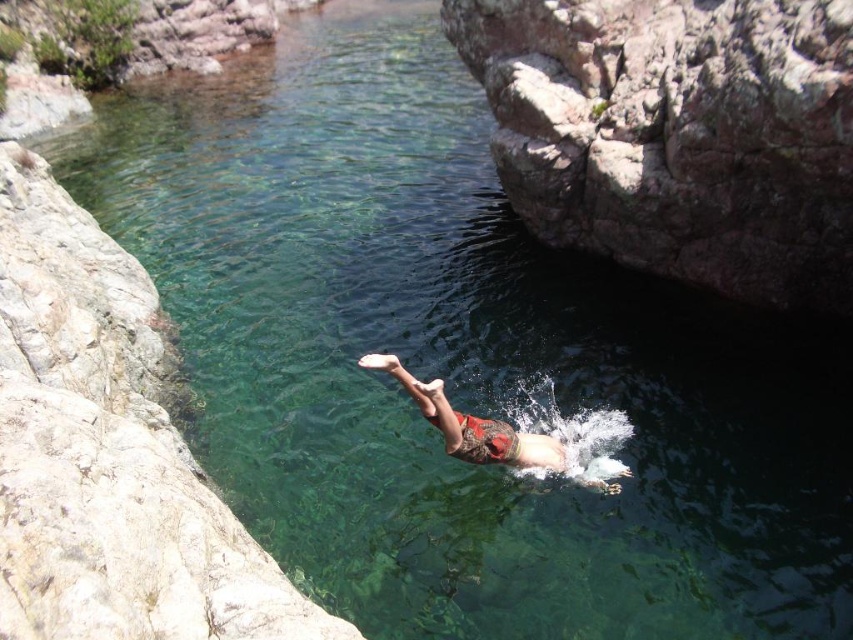
Question: Which object is closer to the camera taking this photo?

Choices:
 (A) smooth gray rock at left
 (B) reddish-brown fabric diver at center
 (C) rusty rock at upper right

Answer: (A)

Question: Which point is closer to the camera taking this photo?

Choices:
 (A) (244, 608)
 (B) (717, 138)

Answer: (A)

Question: Where is rusty rock at upper right located in relation to reddish-brown fabric diver at center in the image?

Choices:
 (A) right
 (B) left

Answer: (A)

Question: Is rusty rock at upper right to the left of reddish-brown fabric diver at center from the viewer's perspective?

Choices:
 (A) no
 (B) yes

Answer: (A)

Question: Does rusty rock at upper right have a greater width compared to smooth gray rock at left?

Choices:
 (A) no
 (B) yes

Answer: (A)

Question: Among these objects, which one is farthest from the camera?

Choices:
 (A) rusty rock at upper right
 (B) smooth gray rock at left

Answer: (A)